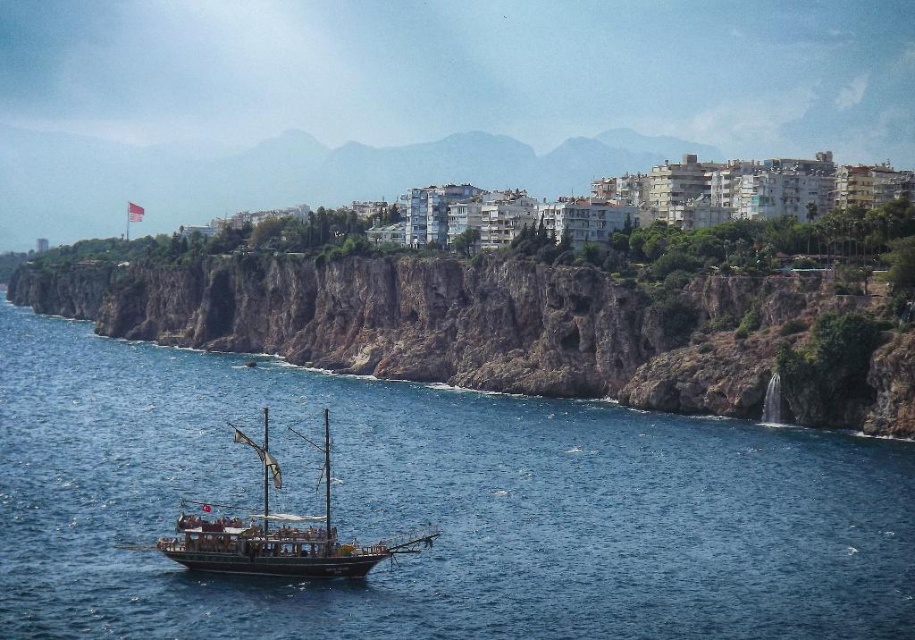
Who is lower down, rugged rock cliff at center or wooden ship at center?

Positioned lower is wooden ship at center.

Does rugged rock cliff at center appear on the right side of wooden ship at center?

Incorrect, rugged rock cliff at center is not on the right side of wooden ship at center.

This screenshot has height=640, width=915. What do you see at coordinates (491, 326) in the screenshot?
I see `rugged rock cliff at center` at bounding box center [491, 326].

The width and height of the screenshot is (915, 640). Identify the location of rugged rock cliff at center. (491, 326).

Who is higher up, blue water at center or rugged rock cliff at center?

rugged rock cliff at center

Who is positioned more to the right, blue water at center or rugged rock cliff at center?

From the viewer's perspective, blue water at center appears more on the right side.

What are the coordinates of `blue water at center` in the screenshot? It's located at (429, 506).

Where is `blue water at center`? The height and width of the screenshot is (640, 915). blue water at center is located at coordinates (429, 506).

Which is more to the left, blue water at center or wooden ship at center?

Positioned to the left is wooden ship at center.

Is blue water at center to the left of wooden ship at center from the viewer's perspective?

Incorrect, blue water at center is not on the left side of wooden ship at center.

The width and height of the screenshot is (915, 640). What do you see at coordinates (429, 506) in the screenshot? I see `blue water at center` at bounding box center [429, 506].

The width and height of the screenshot is (915, 640). Find the location of `blue water at center`. blue water at center is located at coordinates (429, 506).